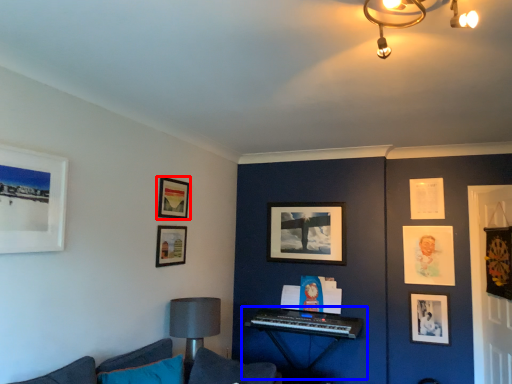
Question: Which of the following is the farthest to the observer, picture frame (highlighted by a red box) or piano (highlighted by a blue box)?

Choices:
 (A) picture frame
 (B) piano

Answer: (B)